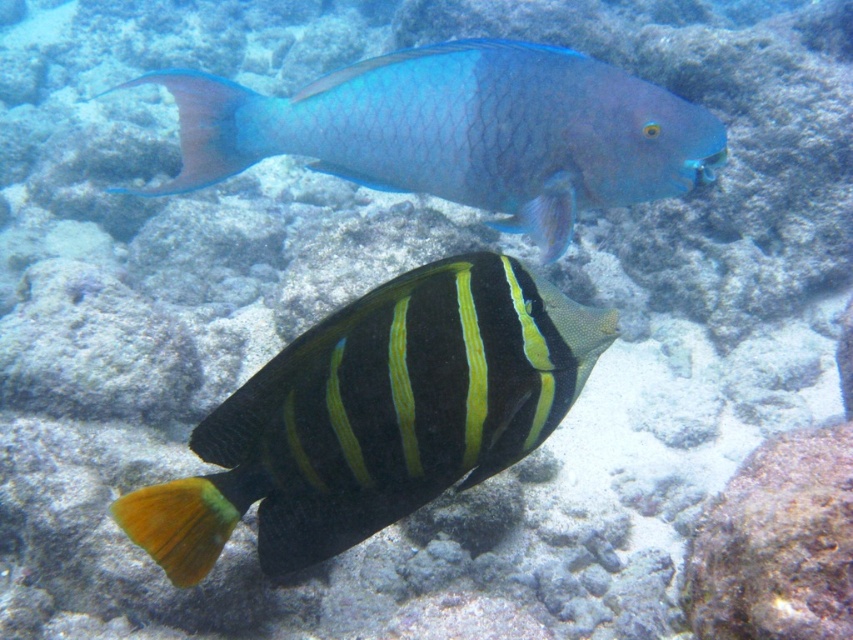
Question: Which point is closer to the camera?

Choices:
 (A) shiny blue parrotfish at upper center
 (B) shiny black and yellow fish at center

Answer: (B)

Question: Can you confirm if shiny black and yellow fish at center is positioned to the right of shiny blue parrotfish at upper center?

Choices:
 (A) no
 (B) yes

Answer: (A)

Question: Is shiny black and yellow fish at center bigger than shiny blue parrotfish at upper center?

Choices:
 (A) no
 (B) yes

Answer: (A)

Question: Which object appears farthest from the camera in this image?

Choices:
 (A) shiny blue parrotfish at upper center
 (B) shiny black and yellow fish at center

Answer: (A)

Question: Does shiny black and yellow fish at center lie behind shiny blue parrotfish at upper center?

Choices:
 (A) no
 (B) yes

Answer: (A)